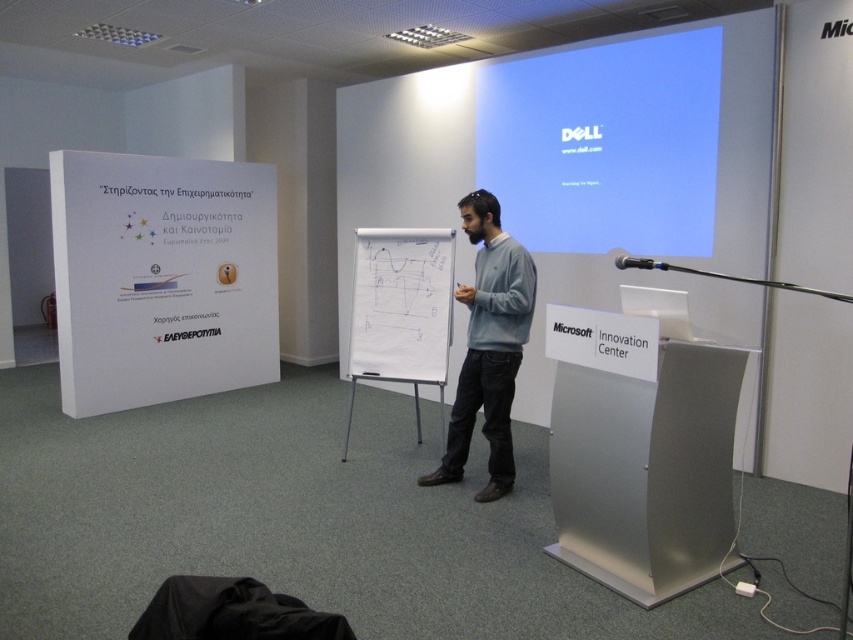
Which is more to the right, white paperboard at left or gray cotton sweater at center?

gray cotton sweater at center is more to the right.

Is point (158, 364) in front of point (491, 241)?

No.

Find the location of a particular element. white paperboard at left is located at coordinates (161, 278).

Who is more forward, (653,444) or (486,148)?

Point (653,444)

Is point (712, 556) behind point (618, 74)?

No, (712, 556) is in front of (618, 74).

Who is more distant from viewer, (650, 412) or (695, 68)?

The point (695, 68) is more distant.

Where is `silver metallic podium at center`? The image size is (853, 640). silver metallic podium at center is located at coordinates (640, 452).

Is white paperboard at left thinner than white glossy projection screen at upper center?

No, white paperboard at left is not thinner than white glossy projection screen at upper center.

Is point (166, 177) farther from viewer compared to point (596, 212)?

Yes, it is.

Image resolution: width=853 pixels, height=640 pixels. What do you see at coordinates (161, 278) in the screenshot? I see `white paperboard at left` at bounding box center [161, 278].

Find the location of `white paperboard at left`. white paperboard at left is located at coordinates (161, 278).